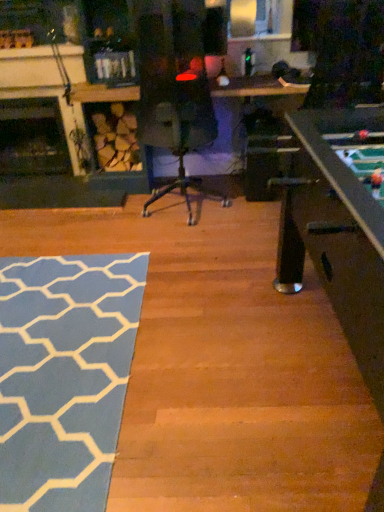
The width and height of the screenshot is (384, 512). I want to click on free location above dark wood fireplace at left, the first fireplace when ordered from front to back (from a real-world perspective), so click(x=31, y=58).